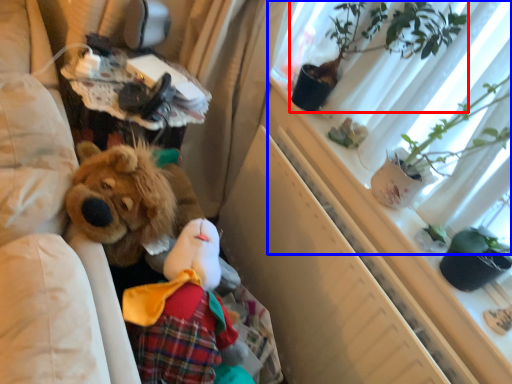
Question: Which object is further to the camera taking this photo, houseplant (highlighted by a red box) or window screen (highlighted by a blue box)?

Choices:
 (A) houseplant
 (B) window screen

Answer: (A)